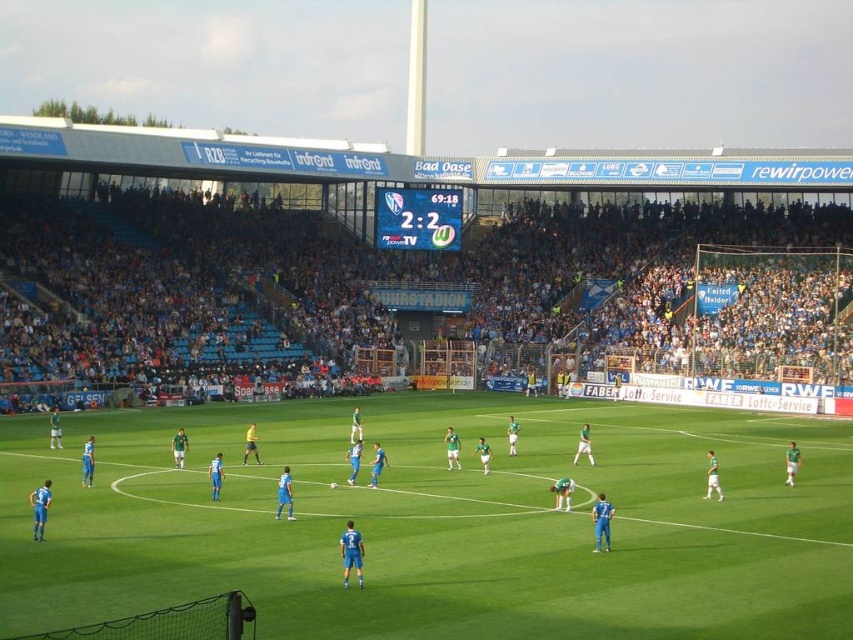
Question: Which point is farther to the camera?

Choices:
 (A) (109, 573)
 (B) (294, 324)

Answer: (B)

Question: Is green grass field at center below blue plastic seats at upper center?

Choices:
 (A) no
 (B) yes

Answer: (B)

Question: Does green grass field at center have a lesser width compared to blue plastic seats at upper center?

Choices:
 (A) yes
 (B) no

Answer: (A)

Question: Which point appears farthest from the camera in this image?

Choices:
 (A) (753, 497)
 (B) (117, 253)

Answer: (B)

Question: Is green grass field at center to the right of blue plastic seats at upper center from the viewer's perspective?

Choices:
 (A) no
 (B) yes

Answer: (B)